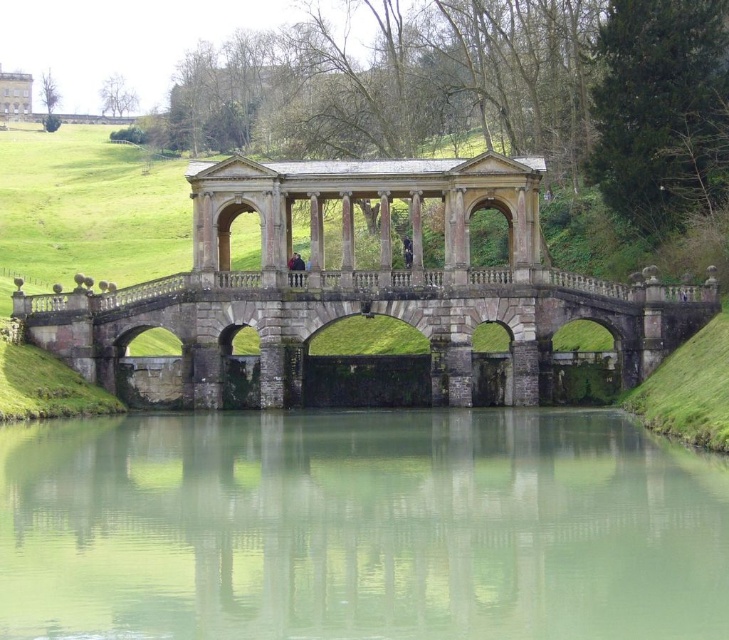
Question: Which object appears closest to the camera in this image?

Choices:
 (A) white stone palace at upper left
 (B) stone arch bridge at center
 (C) green smooth water at center

Answer: (C)

Question: Considering the relative positions of green smooth water at center and white stone palace at upper left in the image provided, where is green smooth water at center located with respect to white stone palace at upper left?

Choices:
 (A) right
 (B) left

Answer: (A)

Question: Is stone arch bridge at center wider than white stone palace at upper left?

Choices:
 (A) no
 (B) yes

Answer: (B)

Question: Which point is closer to the camera?

Choices:
 (A) white stone palace at upper left
 (B) green smooth water at center

Answer: (B)

Question: Can you confirm if stone arch bridge at center is thinner than white stone palace at upper left?

Choices:
 (A) no
 (B) yes

Answer: (A)

Question: Which of the following is the farthest from the observer?

Choices:
 (A) (284, 195)
 (B) (82, 448)
 (C) (23, 88)

Answer: (C)